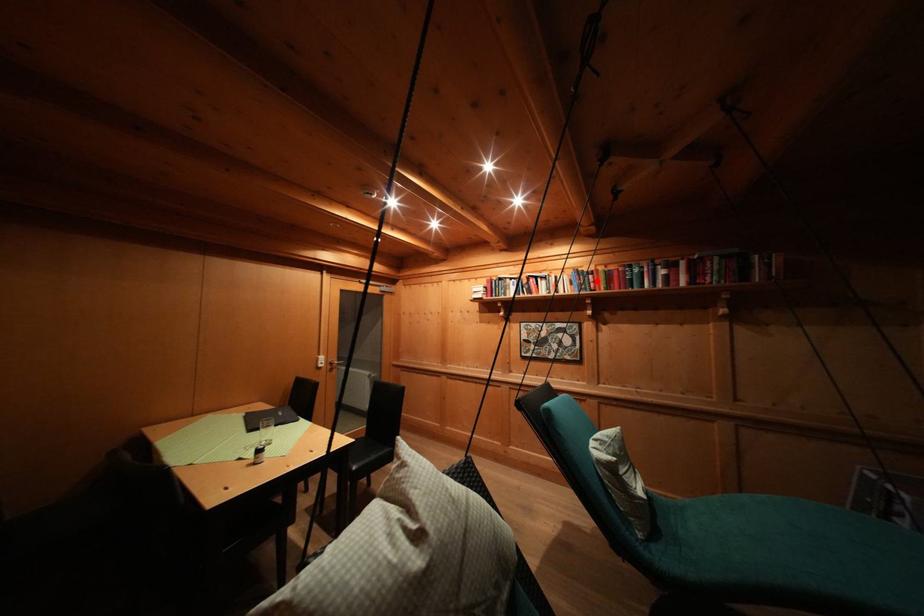
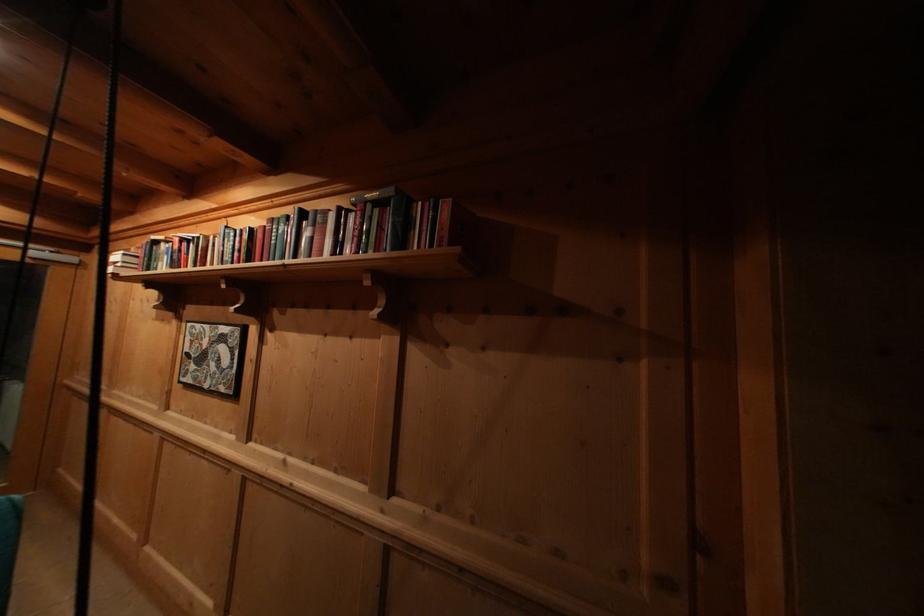
Where in the second image is the point corresponding to the highlighted location from the first image?

(244, 245)